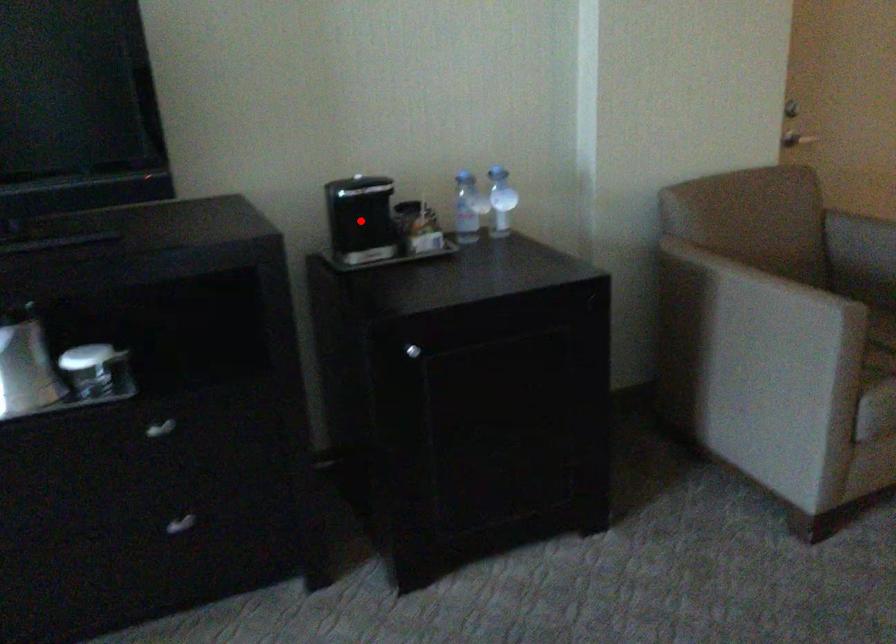
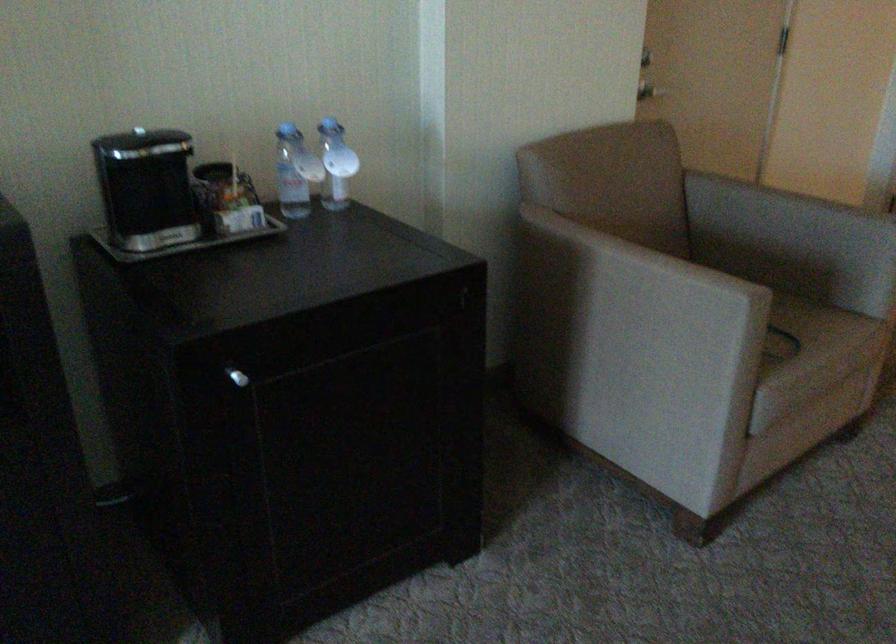
Question: I am providing you with two images of the same scene from different viewpoints. Image1 has a red point marked. In image2, the corresponding 3D location appears at what relative position? Reply with the corresponding letter.

Choices:
 (A) Closer
 (B) Farther

Answer: (A)